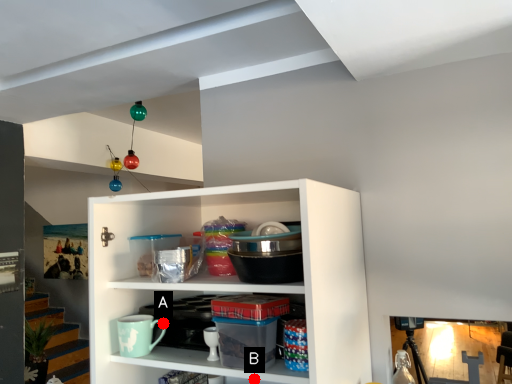
Question: Two points are circled on the image, labeled by A and B beside each circle. Among these points, which one is farthest from the camera?

Choices:
 (A) A is further
 (B) B is further

Answer: (A)